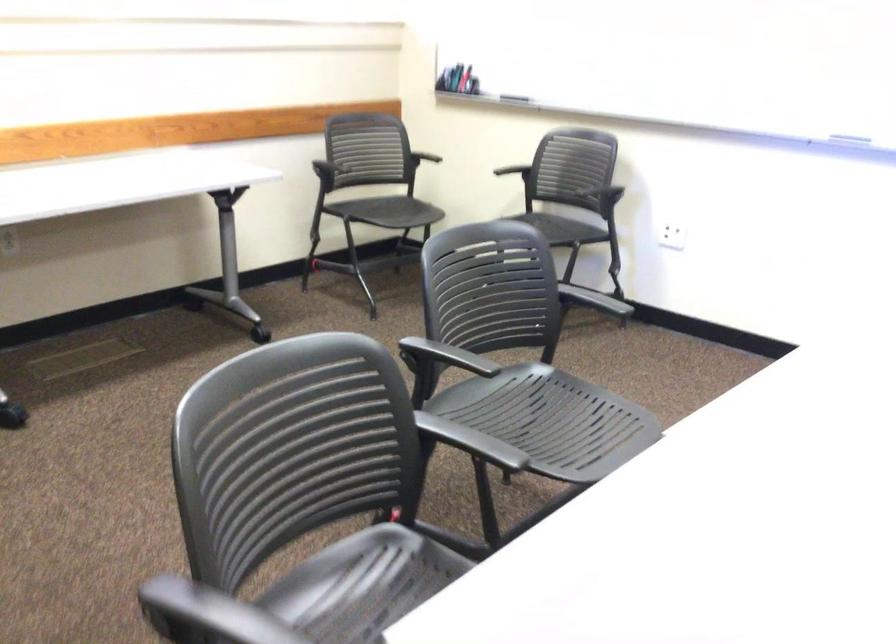
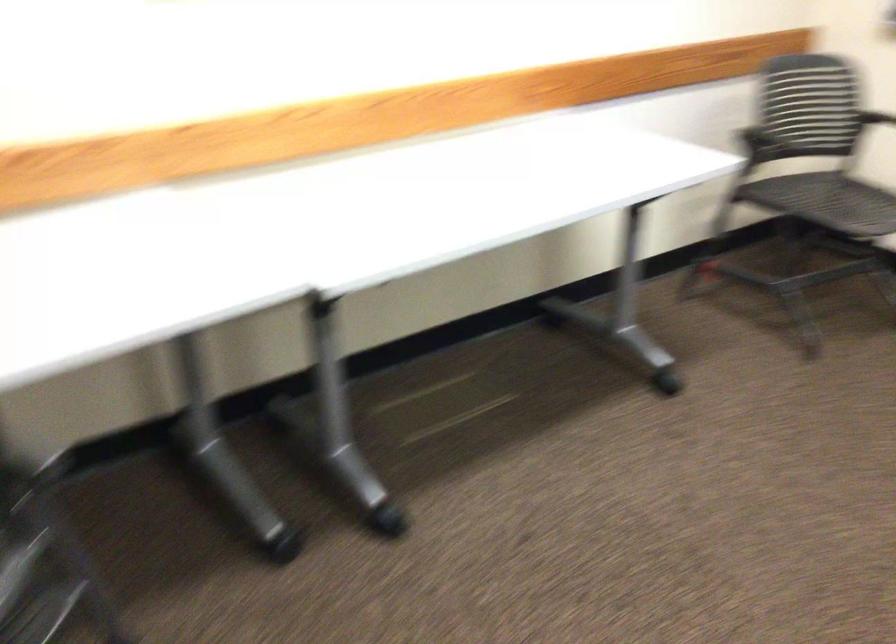
What movement of the cameraman would produce the second image?

The cameraman moved toward left, forward.